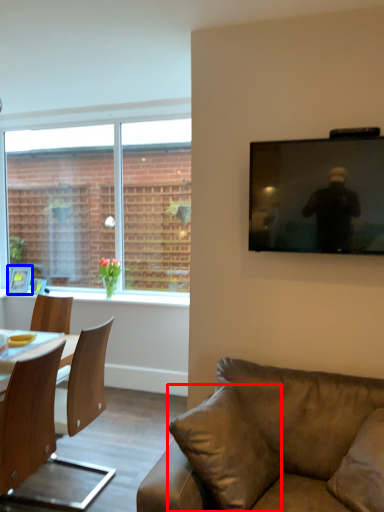
Question: Which of the following is the farthest to the observer, pillow (highlighted by a red box) or picture frame (highlighted by a blue box)?

Choices:
 (A) pillow
 (B) picture frame

Answer: (B)